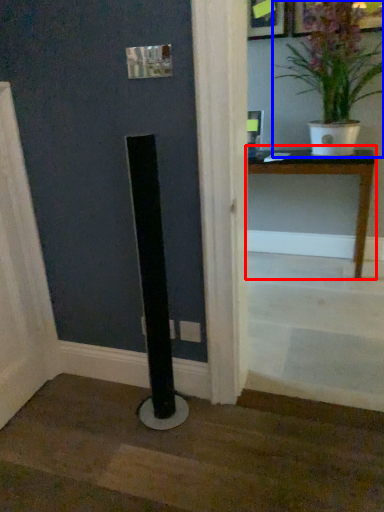
Question: Among these objects, which one is nearest to the camera, table (highlighted by a red box) or houseplant (highlighted by a blue box)?

Choices:
 (A) table
 (B) houseplant

Answer: (B)